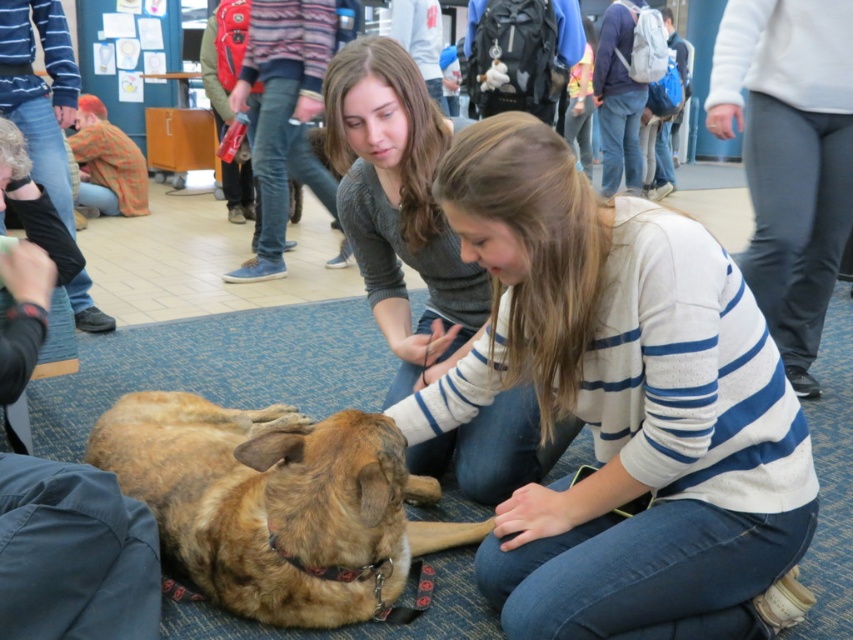
You are standing in the room and want to reach a specific point marked as point (297, 500). If your reach extends 5 feet forward, can you touch that point without moving your feet?

The distance of point (297, 500) from viewer is 4.81 feet, so yes, you can touch that point since it is within your 5 feet reach.

You are a photographer trying to capture a clear shot of the striped sweater at center and the brown fur dog at lower left. Since you want both subjects to be in focus, you need to adjust your camera settings. Which subject is closer to the camera? Please explain your reasoning based on their positions in the image.

The striped sweater at center is located below the brown fur dog at lower left, meaning it is positioned lower in the frame. Since the dog is at the lower left and the sweater is below it, the sweater is closer to the camera than the dog. Therefore, if the camera is focused on the sweater, the dog might be slightly out of focus, and vice versa.

You are a photographer trying to capture both the brown fur dog at center and the brown fur dog at lower left in a single shot. Given that your camera can only focus on one dog at a time, which dog should you focus on to ensure the larger one is in sharp focus?

You should focus on the brown fur dog at center because it is larger in size than the brown fur dog at lower left, so it will require more precise focus to capture details clearly.